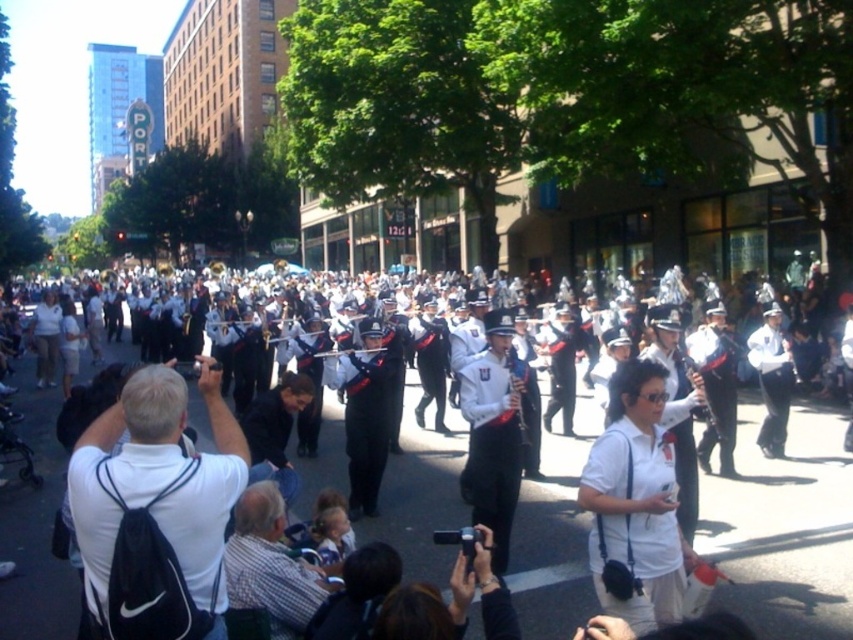
Question: Which object appears closest to the camera in this image?

Choices:
 (A) uniformed band at center
 (B) white matte shirt at center
 (C) matte black clarinet at center

Answer: (B)

Question: Is white glossy uniform at center above white matte shirt at center?

Choices:
 (A) no
 (B) yes

Answer: (A)

Question: Which object is closer to the camera taking this photo?

Choices:
 (A) shiny silver flute at center
 (B) white matte shirt at center
 (C) shiny black uniform at center

Answer: (B)

Question: Which object is farther from the camera taking this photo?

Choices:
 (A) white glossy uniform at center
 (B) shiny black uniform at center
 (C) uniformed band at center
 (D) shiny silver trumpet at center

Answer: (D)

Question: Is uniformed band at center above shiny silver trumpet at center?

Choices:
 (A) yes
 (B) no

Answer: (B)

Question: Is shiny black uniform at center above matte black clarinet at center?

Choices:
 (A) no
 (B) yes

Answer: (A)